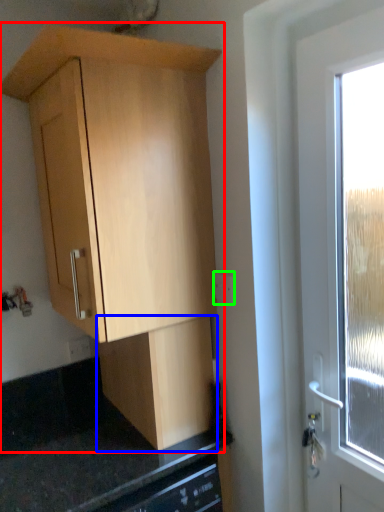
Question: Based on their relative distances, which object is farther from cabinetry (highlighted by a red box)? Choose from cabinetry (highlighted by a blue box) and electric outlet (highlighted by a green box).

Choices:
 (A) cabinetry
 (B) electric outlet

Answer: (B)